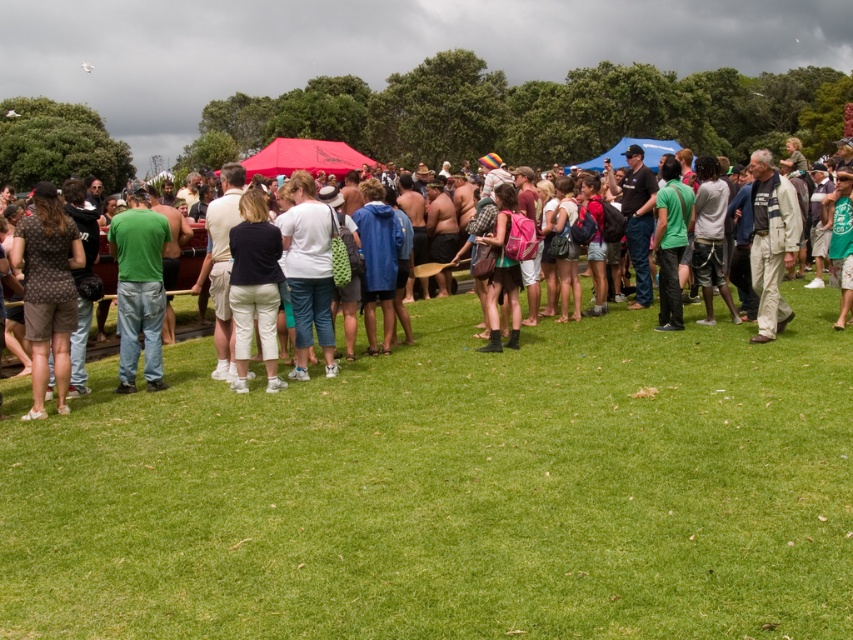
You are a photographer at the event and want to ensure everyone is visible in a group photo. If you position yourself facing the crowd, which person should you ask to stand up to be seen better, the brown dotted shirt at left or the matte green shirt at center?

The brown dotted shirt at left has a lesser height compared to matte green shirt at center, so you should ask the person wearing the brown dotted shirt at left to stand up to be seen better.

You are standing at the edge of the grassy field and see the matte green shirt at center and the dark blue fabric pants at center. Which clothing item is closer to you?

The matte green shirt at center is closer to you because it is in front of the dark blue fabric pants at center.